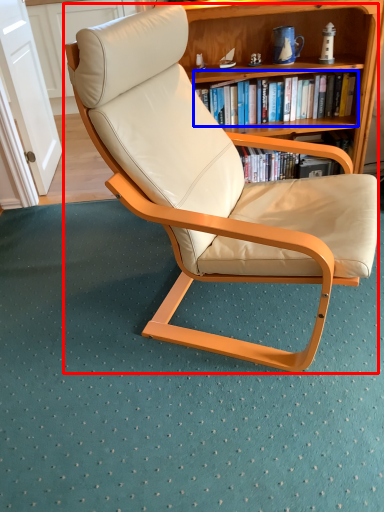
Question: Among these objects, which one is farthest to the camera, chair (highlighted by a red box) or book (highlighted by a blue box)?

Choices:
 (A) chair
 (B) book

Answer: (B)